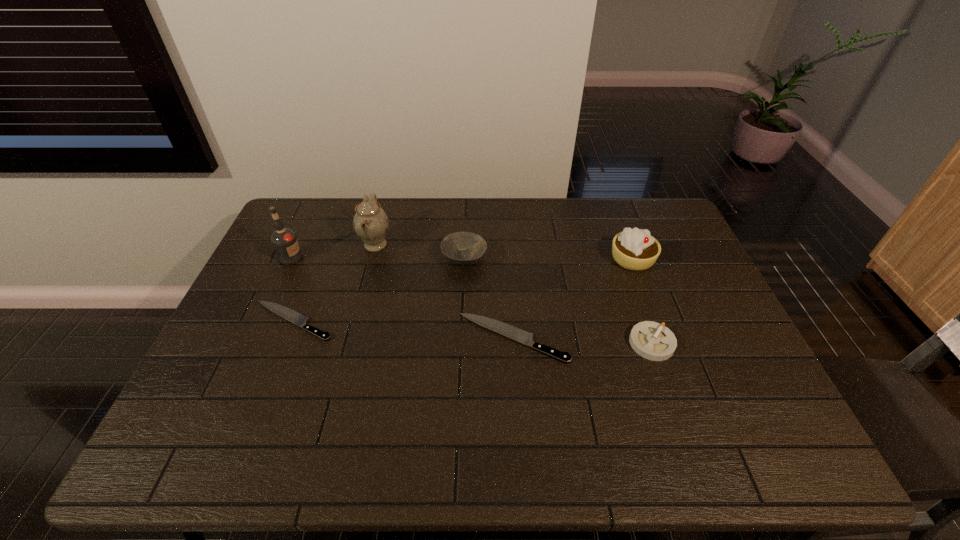
Locate an element on the screen. the shortest object is located at coordinates (285, 312).

You are a GUI agent. You are given a task and a screenshot of the screen. Output one action in this format:
    pyautogui.click(x=<x>, y=<y>)
    Task: Click on the shorter steak knife
    
    Given the screenshot: What is the action you would take?
    pyautogui.click(x=285, y=312)

Where is `the right steak knife`? Image resolution: width=960 pixels, height=540 pixels. the right steak knife is located at coordinates (524, 337).

Find the location of a particular element. The width and height of the screenshot is (960, 540). the taller steak knife is located at coordinates (524, 337).

The width and height of the screenshot is (960, 540). In order to click on the fifth shortest object in this screenshot , I will do `click(635, 249)`.

Find the location of `vodka`. vodka is located at coordinates (284, 240).

In order to click on the fifth tallest object in this screenshot , I will do `click(651, 340)`.

Identify the location of chinaware. (370, 222).

Find the location of `the fourth tallest object`. the fourth tallest object is located at coordinates (463, 248).

Image resolution: width=960 pixels, height=540 pixels. I want to click on free spot located on the back of the left steak knife, so click(x=319, y=257).